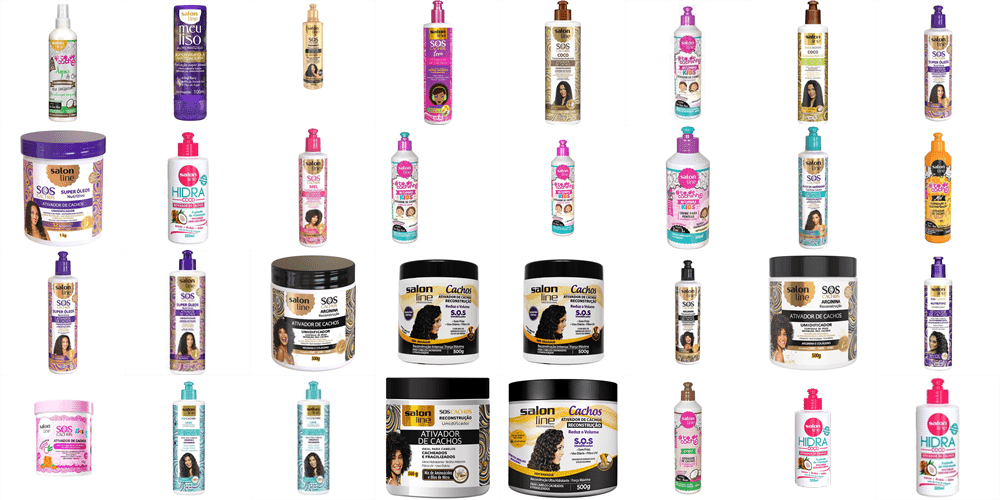
Locate an element on the screen. Image resolution: width=1000 pixels, height=500 pixels. tub is located at coordinates (429, 312), (451, 439), (550, 326), (547, 433), (335, 328), (793, 333), (94, 194), (67, 435).